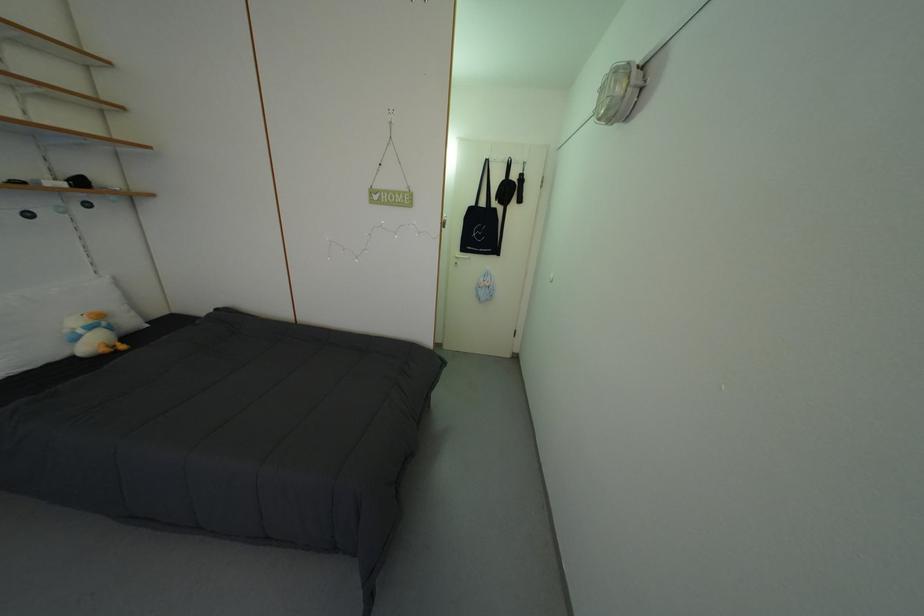
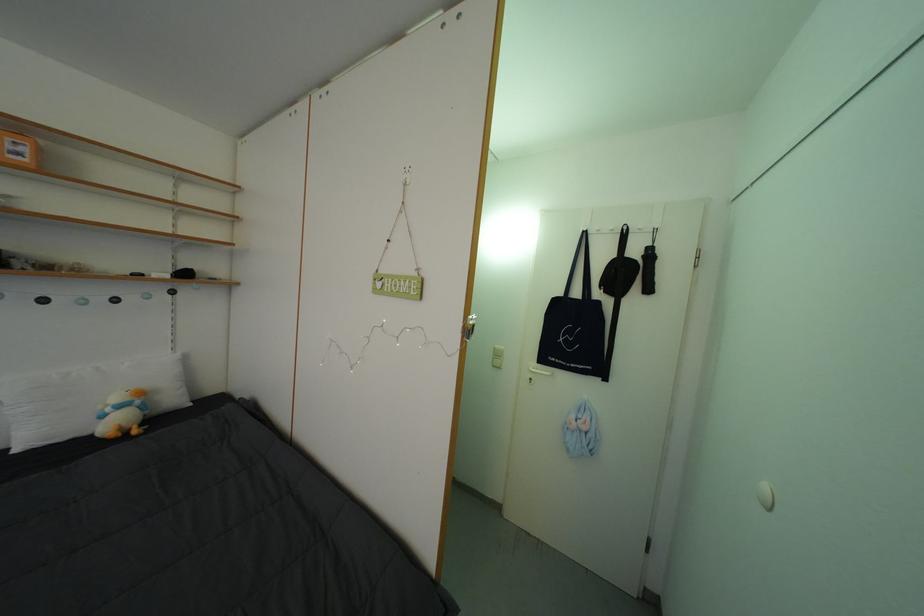
Question: I am providing you with two images of the same scene from different viewpoints. After the viewpoint changes to image2, which objects are now occluded?

Choices:
 (A) black pouch
 (B) orange box
 (C) white wall hook
 (D) none of these

Answer: (D)